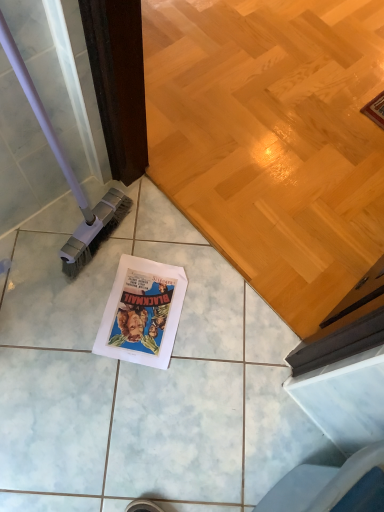
The height and width of the screenshot is (512, 384). I want to click on free space in front of purple plastic brush at left, so click(88, 300).